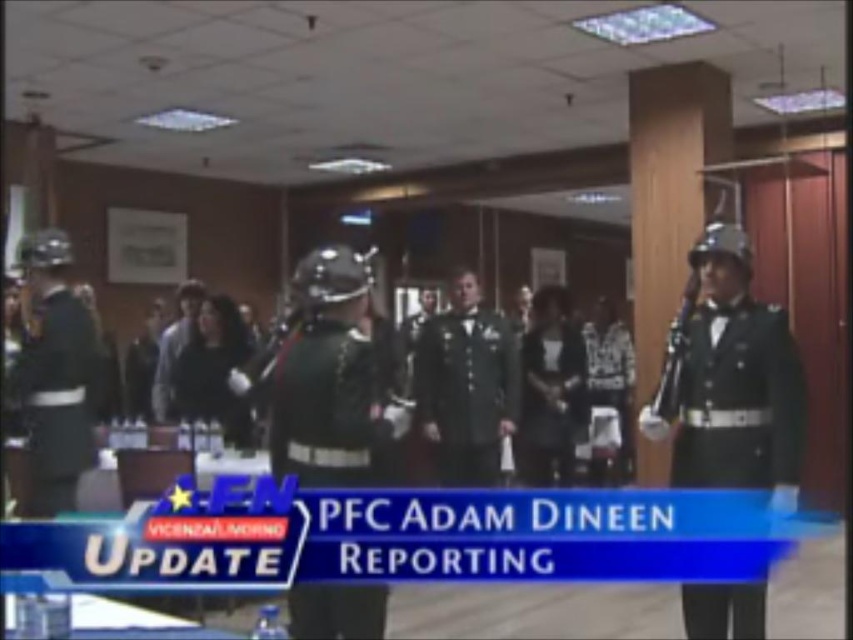
You are a military photographer tasked with capturing a group photo of the dark green fabric uniform at center and the matte black uniform at left. Based on their positions, which uniform is taller?

The dark green fabric uniform at center is taller than the matte black uniform at left according to the description.